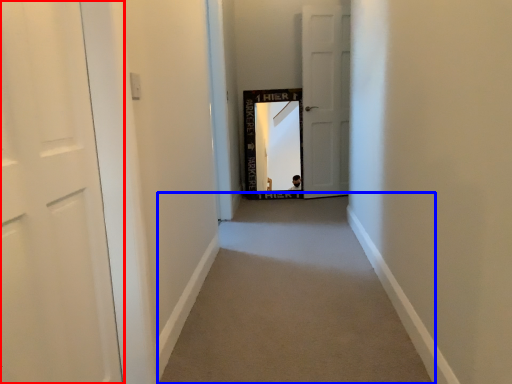
Question: Which object is further to the camera taking this photo, door (highlighted by a red box) or alley (highlighted by a blue box)?

Choices:
 (A) door
 (B) alley

Answer: (B)